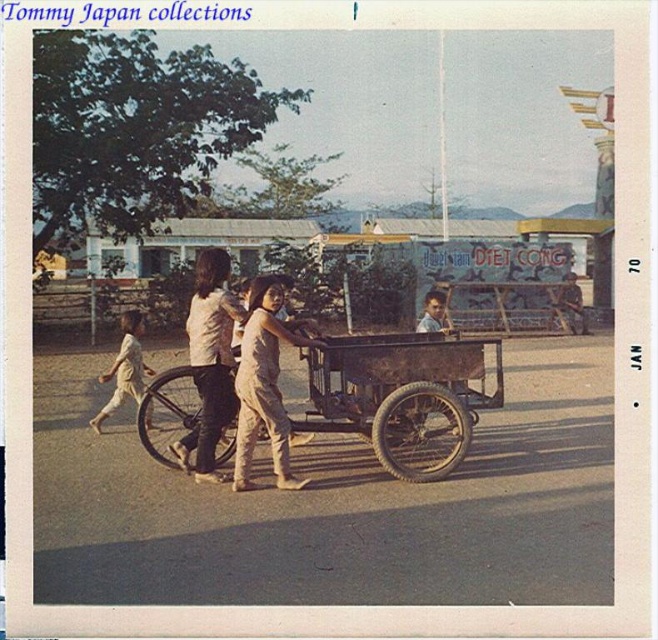
Who is more forward, (236, 449) or (113, 396)?

Positioned in front is point (236, 449).

Can you confirm if light beige fabric dress at center is shorter than light beige cotton pants at center?

No.

Is point (276, 458) positioned behind point (128, 355)?

No, (276, 458) is closer to viewer.

You are a GUI agent. You are given a task and a screenshot of the screen. Output one action in this format:
    pyautogui.click(x=<x>, y=<y>)
    Task: Click on the light beige fabric dress at center
    The image size is (658, 640).
    Given the screenshot: What is the action you would take?
    pyautogui.click(x=265, y=384)

Can you confirm if brown wooden wagon at center is shorter than light beige fabric dress at center?

Yes, brown wooden wagon at center is shorter than light beige fabric dress at center.

Between point (374, 333) and point (266, 348), which one is positioned in front?

Positioned in front is point (266, 348).

Who is more distant from viewer, (482, 342) or (276, 310)?

Point (482, 342)

Identify the location of brown wooden wagon at center. (401, 396).

Is light beige fabric dress at center closer to camera compared to smooth skin boy at center?

Yes, it is.

Which is behind, point (274, 301) or point (422, 324)?

Positioned behind is point (422, 324).

Is point (241, 476) behind point (430, 291)?

No, (241, 476) is in front of (430, 291).

You are a GUI agent. You are given a task and a screenshot of the screen. Output one action in this format:
    pyautogui.click(x=<x>, y=<y>)
    Task: Click on the light beige fabric dress at center
    
    Given the screenshot: What is the action you would take?
    pyautogui.click(x=265, y=384)